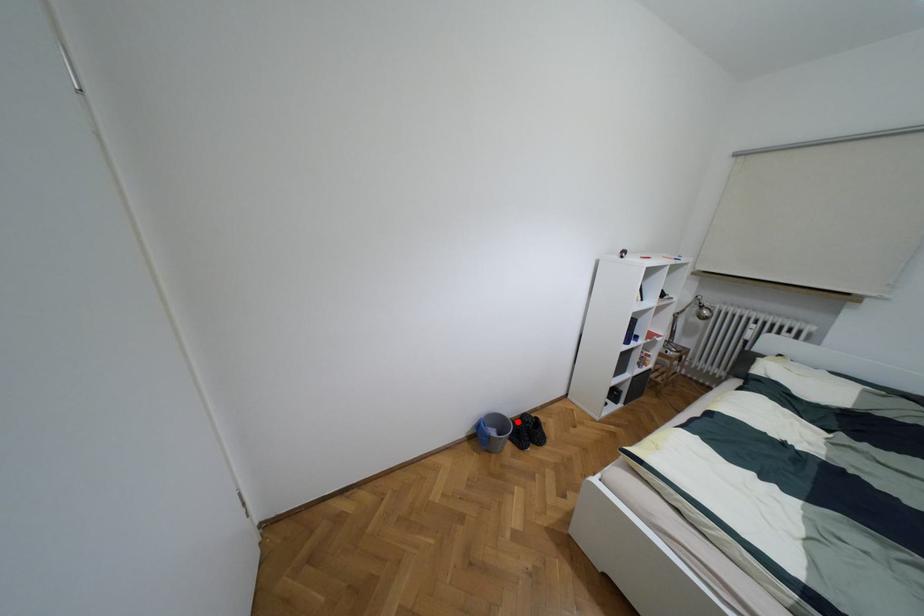
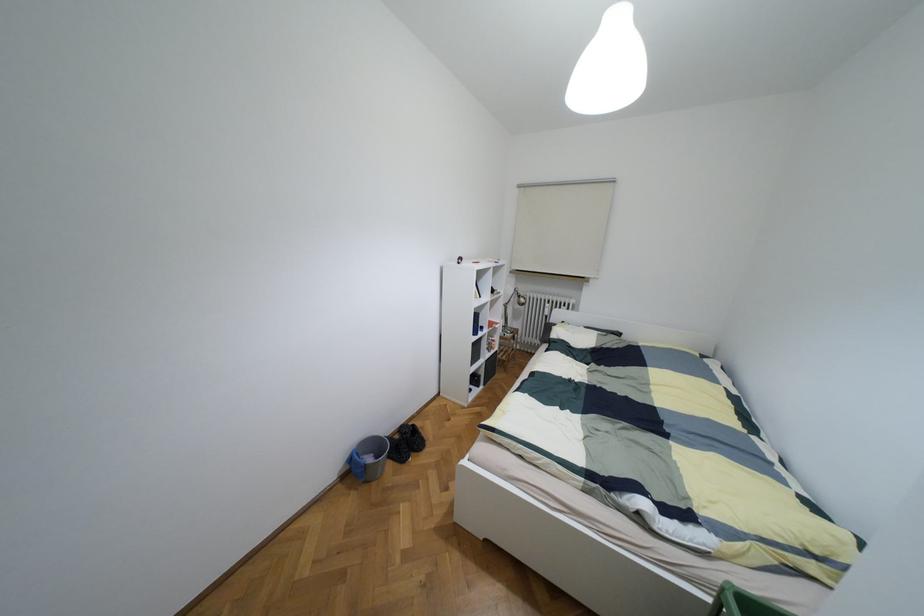
Find the pixel in the second image that matches the highlighted location in the first image.

(395, 436)